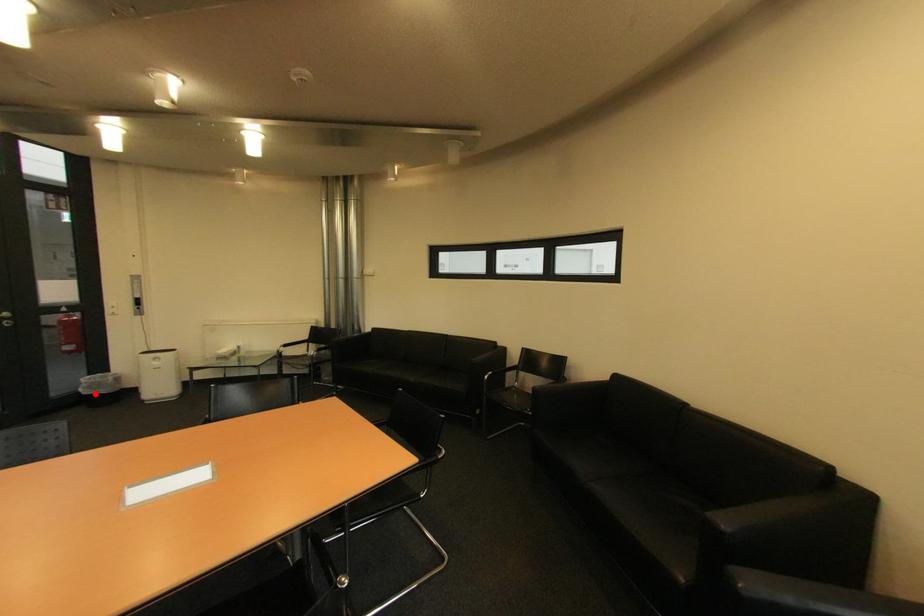
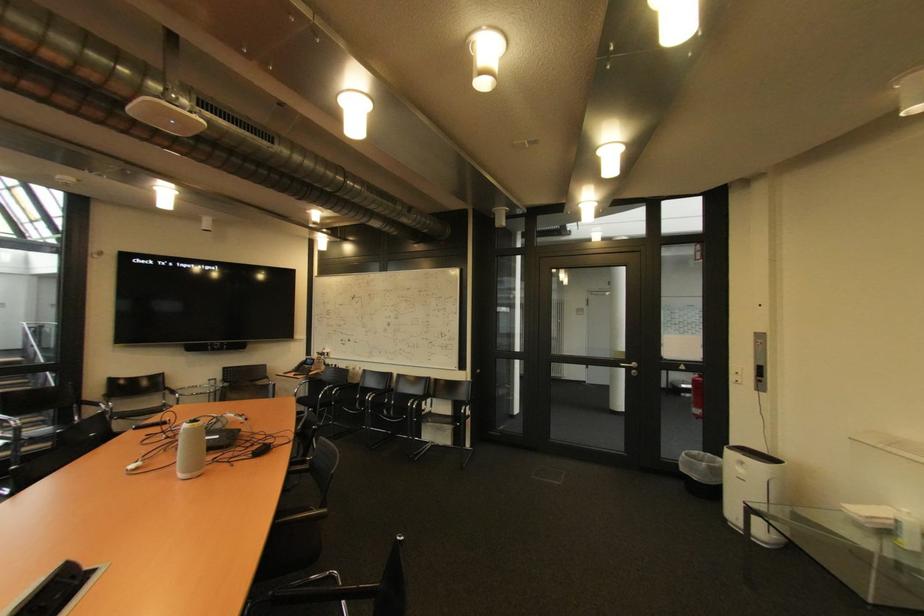
Locate, in the second image, the point that corresponds to the highlighted location in the first image.

(690, 471)